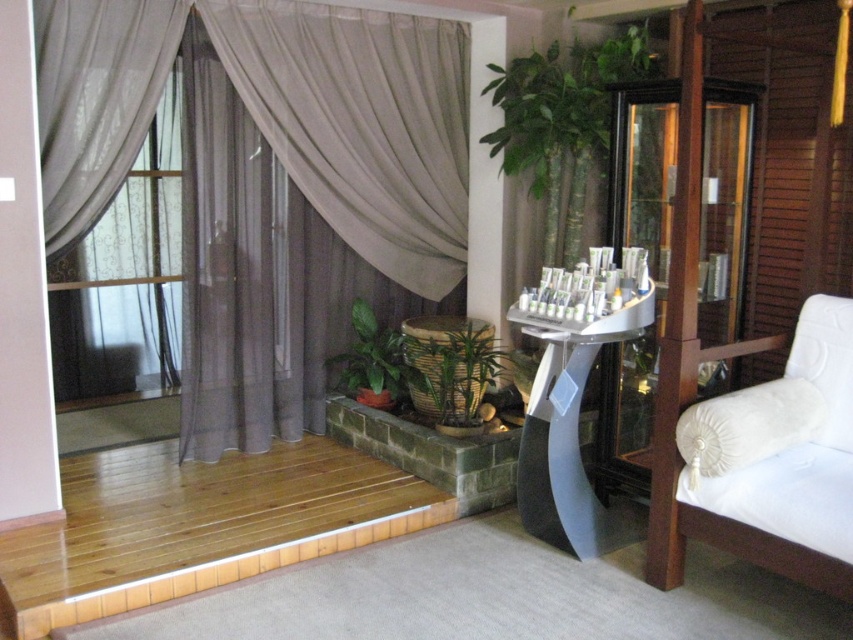
Question: Is green leafy plant at upper center positioned behind green woven basket at center?

Choices:
 (A) yes
 (B) no

Answer: (B)

Question: Considering the real-world distances, which object is farthest from the transparent glass cabinet at right?

Choices:
 (A) green woven basket at center
 (B) white fabric pillow at right
 (C) braided wicker basket at center

Answer: (A)

Question: From the image, what is the correct spatial relationship of white fabric pillow at right in relation to green woven basket at center?

Choices:
 (A) left
 (B) right

Answer: (B)

Question: Does white fabric armchair at right appear on the right side of transparent glass cabinet at right?

Choices:
 (A) no
 (B) yes

Answer: (B)

Question: Which object is closer to the camera taking this photo?

Choices:
 (A) green woven basket at center
 (B) braided wicker basket at center

Answer: (B)

Question: Among these points, which one is farthest from the camera?

Choices:
 (A) (811, 513)
 (B) (761, 385)
 (C) (721, 113)
 (D) (532, 390)

Answer: (C)